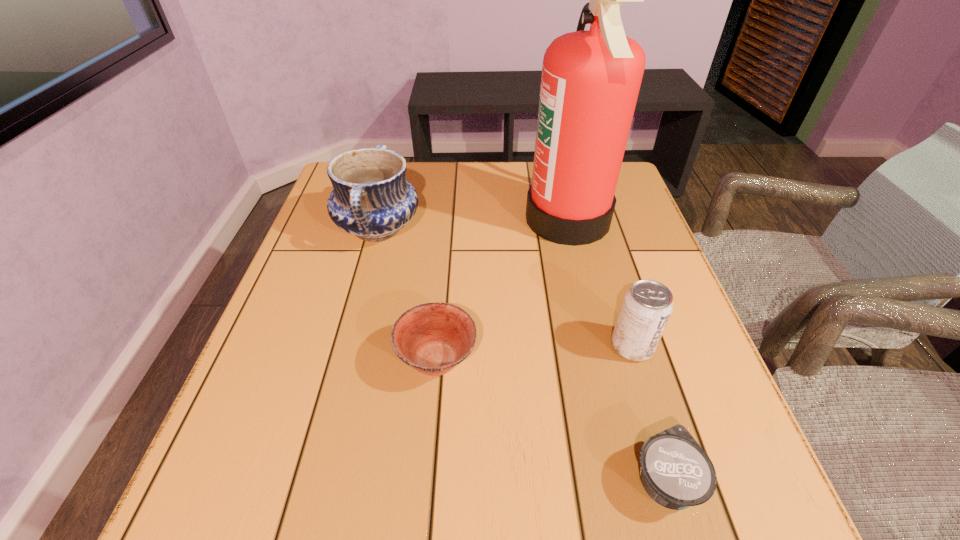
Image resolution: width=960 pixels, height=540 pixels. Find the location of `fire extinguisher`. fire extinguisher is located at coordinates (590, 82).

You are a GUI agent. You are given a task and a screenshot of the screen. Output one action in this format:
    pyautogui.click(x=<x>, y=<y>)
    Task: Click on the pottery
    This screenshot has height=540, width=960.
    Given the screenshot: What is the action you would take?
    pyautogui.click(x=371, y=198)

Find the location of a particular element. soda can is located at coordinates (646, 308).

You are a GUI agent. You are given a task and a screenshot of the screen. Output one action in this format:
    pyautogui.click(x=<x>, y=<y>)
    Task: Click on the second shortest object
    This screenshot has height=540, width=960.
    Given the screenshot: What is the action you would take?
    pyautogui.click(x=433, y=338)

Identify the location of yogurt. coord(675,471).

Where is `the nearest object`? the nearest object is located at coordinates (675, 471).

This screenshot has height=540, width=960. I want to click on vacant region located 0.220m at the nozzle of the fire extinguisher, so click(x=441, y=219).

Identify the location of vacant point located 0.170m at the nozzle of the fire extinguisher. (460, 219).

Image resolution: width=960 pixels, height=540 pixels. I want to click on free space located at the nozzle of the fire extinguisher, so click(x=495, y=219).

Where is `vacant space situated on the front of the second tallest object`? The width and height of the screenshot is (960, 540). vacant space situated on the front of the second tallest object is located at coordinates (360, 296).